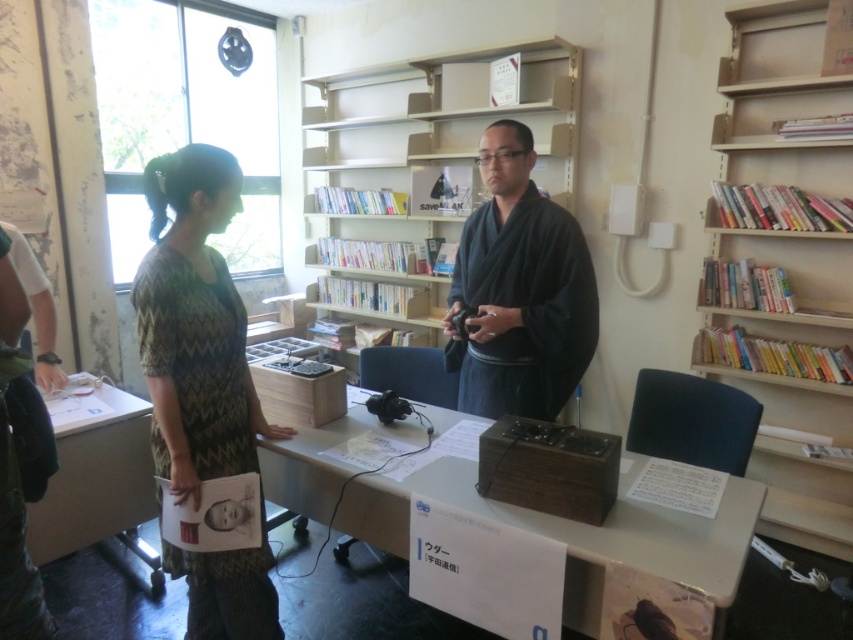
Can you confirm if patterned fabric dress at left is shorter than dark blue kimono at center?

No.

Does patterned fabric dress at left come in front of dark blue kimono at center?

Yes, patterned fabric dress at left is closer to the viewer.

Locate an element on the screen. patterned fabric dress at left is located at coordinates (195, 324).

Is wooden bookshelf at right closer to camera compared to white glossy table at lower left?

That is False.

Between wooden bookshelf at right and white glossy table at lower left, which one appears on the left side from the viewer's perspective?

white glossy table at lower left is more to the left.

Image resolution: width=853 pixels, height=640 pixels. What do you see at coordinates (779, 97) in the screenshot?
I see `wooden bookshelf at right` at bounding box center [779, 97].

This screenshot has height=640, width=853. Identify the location of wooden bookshelf at right. (779, 97).

Does wooden table at center appear under dark blue kimono at center?

Yes, wooden table at center is below dark blue kimono at center.

Based on the photo, is wooden table at center smaller than dark blue kimono at center?

Incorrect, wooden table at center is not smaller in size than dark blue kimono at center.

The image size is (853, 640). In order to click on wooden table at center in this screenshot , I will do `click(577, 531)`.

This screenshot has height=640, width=853. Find the location of `wooden table at center`. wooden table at center is located at coordinates click(577, 531).